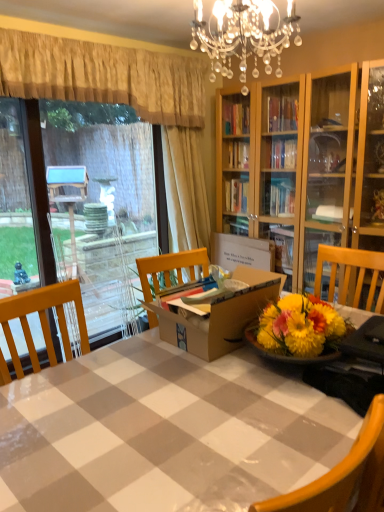
Question: Is yellow textured curtain at upper left, the 1th curtain viewed from the left, positioned with its back to beige fabric curtain at upper left, the 2th curtain when ordered from left to right?

Choices:
 (A) yes
 (B) no

Answer: (B)

Question: Is the depth of yellow textured curtain at upper left, the 1th curtain viewed from the left, less than that of beige fabric curtain at upper left, the 2th curtain when ordered from left to right?

Choices:
 (A) yes
 (B) no

Answer: (A)

Question: From a real-world perspective, is yellow textured curtain at upper left, the 1th curtain viewed from the left, below beige fabric curtain at upper left, the 2th curtain when ordered from left to right?

Choices:
 (A) no
 (B) yes

Answer: (A)

Question: Considering the relative positions of yellow textured curtain at upper left, arranged as the 2th curtain when viewed from the right, and beige fabric curtain at upper left, the 2th curtain when ordered from left to right, in the image provided, is yellow textured curtain at upper left, arranged as the 2th curtain when viewed from the right, to the left of beige fabric curtain at upper left, the 2th curtain when ordered from left to right, from the viewer's perspective?

Choices:
 (A) no
 (B) yes

Answer: (B)

Question: Is beige fabric curtain at upper left, the 2th curtain when ordered from left to right, a part of yellow textured curtain at upper left, arranged as the 2th curtain when viewed from the right?

Choices:
 (A) no
 (B) yes

Answer: (A)

Question: From a real-world perspective, is white glossy table at center positioned above or below transparent glass door at left?

Choices:
 (A) below
 (B) above

Answer: (A)

Question: In terms of width, does white glossy table at center look wider or thinner when compared to transparent glass door at left?

Choices:
 (A) thin
 (B) wide

Answer: (B)

Question: From the image's perspective, relative to transparent glass door at left, is white glossy table at center above or below?

Choices:
 (A) above
 (B) below

Answer: (B)

Question: Is point (299, 485) closer or farther from the camera than point (26, 208)?

Choices:
 (A) closer
 (B) farther

Answer: (A)

Question: From the image's perspective, is wooden chair at lower right positioned above or below brown cardboard box at center?

Choices:
 (A) below
 (B) above

Answer: (A)

Question: Looking at their shapes, would you say wooden chair at lower right is wider or thinner than brown cardboard box at center?

Choices:
 (A) wide
 (B) thin

Answer: (B)

Question: Considering the positions of wooden chair at lower right and brown cardboard box at center in the image, is wooden chair at lower right bigger or smaller than brown cardboard box at center?

Choices:
 (A) small
 (B) big

Answer: (B)

Question: From a real-world perspective, is wooden chair at lower right above or below brown cardboard box at center?

Choices:
 (A) below
 (B) above

Answer: (A)

Question: Is brown cardboard box at center inside or outside of yellow textured curtain at upper left, the 1th curtain viewed from the left?

Choices:
 (A) outside
 (B) inside

Answer: (A)

Question: Considering the positions of point (200, 335) and point (44, 83), is point (200, 335) closer or farther from the camera than point (44, 83)?

Choices:
 (A) farther
 (B) closer

Answer: (B)